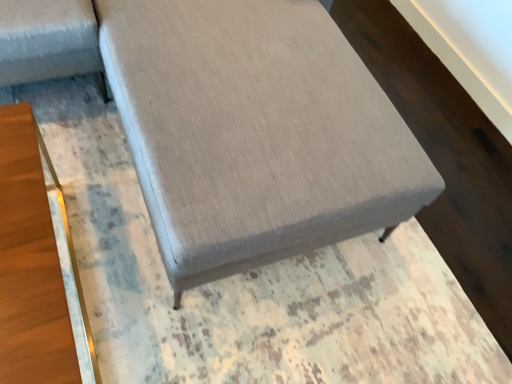
The height and width of the screenshot is (384, 512). Find the location of `matte gray fabric ottoman at center`. matte gray fabric ottoman at center is located at coordinates (255, 132).

The width and height of the screenshot is (512, 384). Describe the element at coordinates (255, 132) in the screenshot. I see `matte gray fabric ottoman at center` at that location.

Find the location of a particular element. This screenshot has width=512, height=384. matte gray fabric ottoman at center is located at coordinates (255, 132).